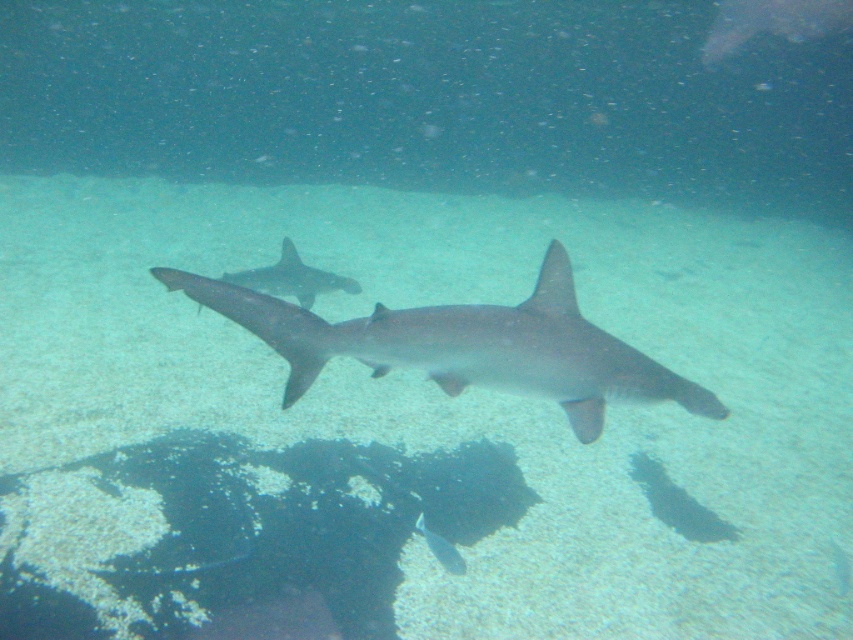
From the picture: You are a marine biologist observing the underwater scene. You notice the gray matte shark at center and the shiny silver fish at center. Which of these two has a greater width?

The gray matte shark at center has a greater width than the shiny silver fish at center.

You are a marine biologist observing the underwater scene. You notice the gray matte shark at center and the shiny silver fish at center. Which of these two marine creatures has a larger height?

The gray matte shark at center has a greater height compared to the shiny silver fish at center.